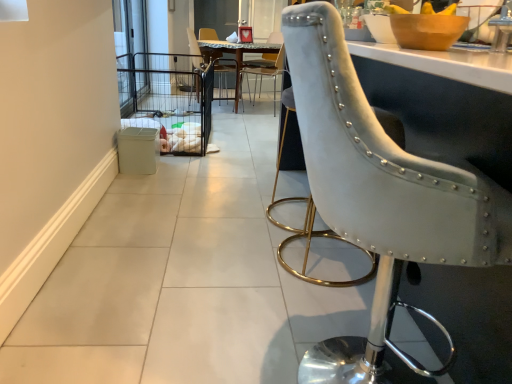
Question: Does suede-like gray chair at right, which is counted as the 1th chair, starting from the front, appear on the right side of marble top table at center?

Choices:
 (A) no
 (B) yes

Answer: (B)

Question: Is suede-like gray chair at right, arranged as the third chair when viewed from the back, bigger than marble top table at center?

Choices:
 (A) no
 (B) yes

Answer: (A)

Question: Is the position of suede-like gray chair at right, which is counted as the 1th chair, starting from the front, more distant than that of marble top table at center?

Choices:
 (A) no
 (B) yes

Answer: (A)

Question: Considering the relative sizes of suede-like gray chair at right, arranged as the third chair when viewed from the back, and marble top table at center in the image provided, is suede-like gray chair at right, arranged as the third chair when viewed from the back, shorter than marble top table at center?

Choices:
 (A) yes
 (B) no

Answer: (B)

Question: From a real-world perspective, is suede-like gray chair at right, arranged as the third chair when viewed from the back, beneath marble top table at center?

Choices:
 (A) no
 (B) yes

Answer: (A)

Question: Considering the positions of marble top table at center and clear glass screen door at upper left in the image, is marble top table at center bigger or smaller than clear glass screen door at upper left?

Choices:
 (A) small
 (B) big

Answer: (B)

Question: From the image's perspective, is marble top table at center located above or below clear glass screen door at upper left?

Choices:
 (A) above
 (B) below

Answer: (B)

Question: Is point (237, 107) closer or farther from the camera than point (133, 74)?

Choices:
 (A) closer
 (B) farther

Answer: (B)

Question: Considering their positions, is marble top table at center located in front of or behind clear glass screen door at upper left?

Choices:
 (A) behind
 (B) front

Answer: (A)

Question: Considering the relative positions of marble top table at center and wooden bowl at upper right in the image provided, is marble top table at center to the left or to the right of wooden bowl at upper right?

Choices:
 (A) right
 (B) left

Answer: (B)

Question: Is marble top table at center wider or thinner than wooden bowl at upper right?

Choices:
 (A) wide
 (B) thin

Answer: (A)

Question: Choose the correct answer: Is marble top table at center inside wooden bowl at upper right or outside it?

Choices:
 (A) outside
 (B) inside

Answer: (A)

Question: From the image's perspective, relative to wooden bowl at upper right, is marble top table at center above or below?

Choices:
 (A) above
 (B) below

Answer: (A)

Question: Considering their positions, is white plastic trash bin at lower left located in front of or behind clear glass screen door at upper left?

Choices:
 (A) behind
 (B) front

Answer: (B)

Question: Is white plastic trash bin at lower left wider or thinner than clear glass screen door at upper left?

Choices:
 (A) thin
 (B) wide

Answer: (B)